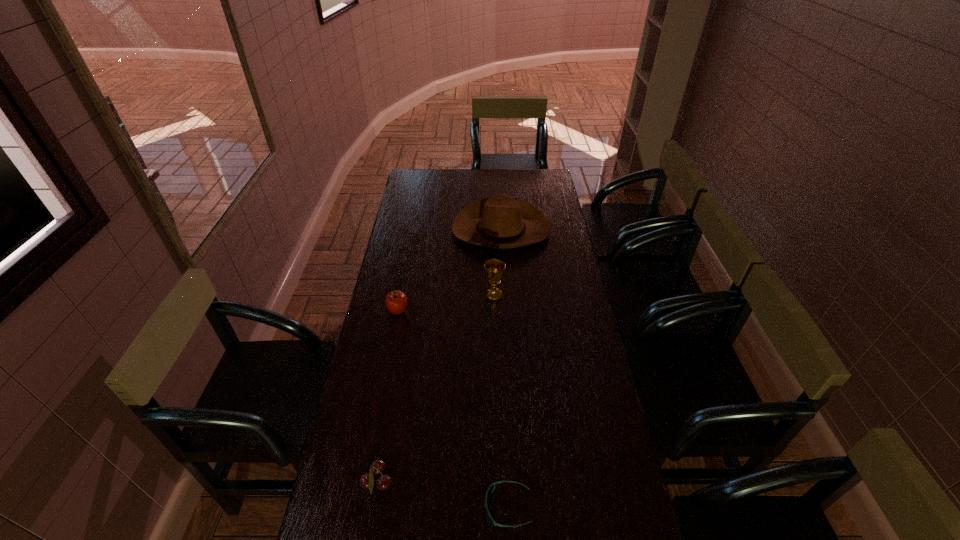
Where is `cowboy hat`? cowboy hat is located at coordinates (501, 222).

Locate an element on the screen. The height and width of the screenshot is (540, 960). the second farthest object is located at coordinates (494, 269).

Locate an element on the screen. the third nearest object is located at coordinates (396, 301).

What are the coordinates of `cherry` in the screenshot? It's located at (367, 481).

In order to click on the shortest object in this screenshot , I will do `click(490, 489)`.

Locate an element on the screen. free location located 0.250m on the front-facing side of the cowboy hat is located at coordinates (505, 295).

Locate an element on the screen. The width and height of the screenshot is (960, 540). vacant area situated 0.180m on the left of the second farthest object is located at coordinates (440, 296).

I want to click on vacant region located on the back of the apple, so click(406, 269).

Identify the location of vacant space situated 0.330m on the leaves of the cherry. The height and width of the screenshot is (540, 960). (512, 483).

In order to click on vacant space situated on the front-facing side of the sunglasses in this screenshot , I will do `click(350, 507)`.